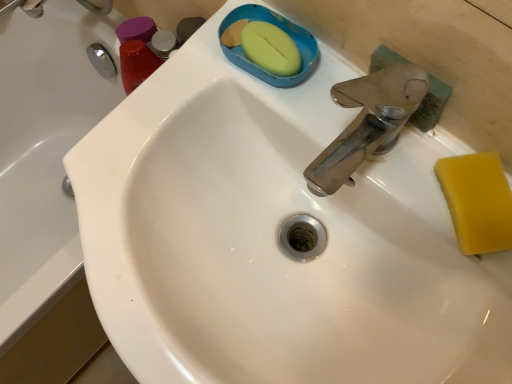
Question: Is white glossy sink at center smaller than yellow sponge at right?

Choices:
 (A) yes
 (B) no

Answer: (B)

Question: Considering the relative positions of white glossy sink at center and yellow sponge at right in the image provided, is white glossy sink at center to the right of yellow sponge at right from the viewer's perspective?

Choices:
 (A) yes
 (B) no

Answer: (B)

Question: Considering the relative sizes of white glossy sink at center and yellow sponge at right in the image provided, is white glossy sink at center taller than yellow sponge at right?

Choices:
 (A) no
 (B) yes

Answer: (B)

Question: Is white glossy sink at center positioned with its back to yellow sponge at right?

Choices:
 (A) no
 (B) yes

Answer: (A)

Question: From a real-world perspective, is white glossy sink at center beneath yellow sponge at right?

Choices:
 (A) yes
 (B) no

Answer: (A)

Question: Considering the relative sizes of white glossy sink at center and yellow sponge at right in the image provided, is white glossy sink at center thinner than yellow sponge at right?

Choices:
 (A) no
 (B) yes

Answer: (A)

Question: Considering the relative sizes of yellow sponge at right and white glossy sink at center in the image provided, is yellow sponge at right taller than white glossy sink at center?

Choices:
 (A) no
 (B) yes

Answer: (A)

Question: Is yellow sponge at right next to white glossy sink at center and touching it?

Choices:
 (A) no
 (B) yes

Answer: (A)

Question: Is yellow sponge at right positioned with its back to white glossy sink at center?

Choices:
 (A) yes
 (B) no

Answer: (B)

Question: Can you confirm if yellow sponge at right is thinner than white glossy sink at center?

Choices:
 (A) yes
 (B) no

Answer: (A)

Question: From the image's perspective, is yellow sponge at right located beneath white glossy sink at center?

Choices:
 (A) no
 (B) yes

Answer: (A)

Question: Is yellow sponge at right closer to camera compared to white glossy sink at center?

Choices:
 (A) no
 (B) yes

Answer: (B)

Question: Based on their positions, is white glossy sink at center located to the left or right of yellow sponge at right?

Choices:
 (A) right
 (B) left

Answer: (B)